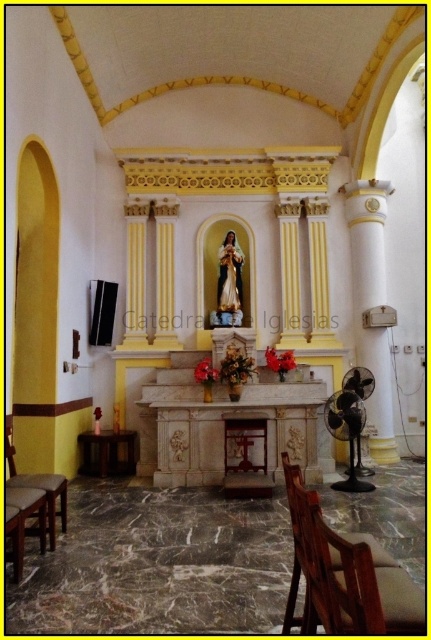
Is wooden chair at lower right bigger than brown leather chair at lower left?

No.

At what (x,y) coordinates should I click in order to perform the action: click on wooden chair at lower right. Please return your answer as a coordinate pair (x, y). Looking at the image, I should click on (306, 556).

At what (x,y) coordinates should I click in order to perform the action: click on wooden chair at lower right. Please return your answer as a coordinate pair (x, y). This screenshot has width=431, height=640. Looking at the image, I should click on tap(306, 556).

Is point (334, 417) behind point (65, 490)?

Yes.

This screenshot has height=640, width=431. Identify the location of black plastic fan at lower right. [349, 420].

Locate an element on the screen. The height and width of the screenshot is (640, 431). black plastic fan at lower right is located at coordinates (349, 420).

Between point (365, 536) and point (334, 410), which one is positioned behind?

The point (334, 410) is behind.

Does point (321, 624) come farther from viewer compared to point (349, 400)?

No, it is in front of (349, 400).

Measure the distance between point (318,605) and camera.

7.84 feet

Where is `wooden chair at lower right`? This screenshot has height=640, width=431. wooden chair at lower right is located at coordinates (306, 556).